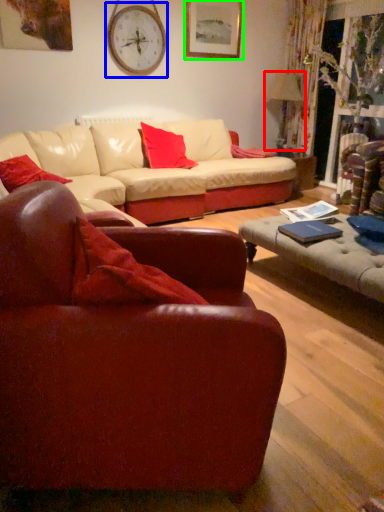
Question: Based on their relative distances, which object is nearer to lamp (highlighted by a red box)? Choose from clock (highlighted by a blue box) and picture frame (highlighted by a green box).

Choices:
 (A) clock
 (B) picture frame

Answer: (B)